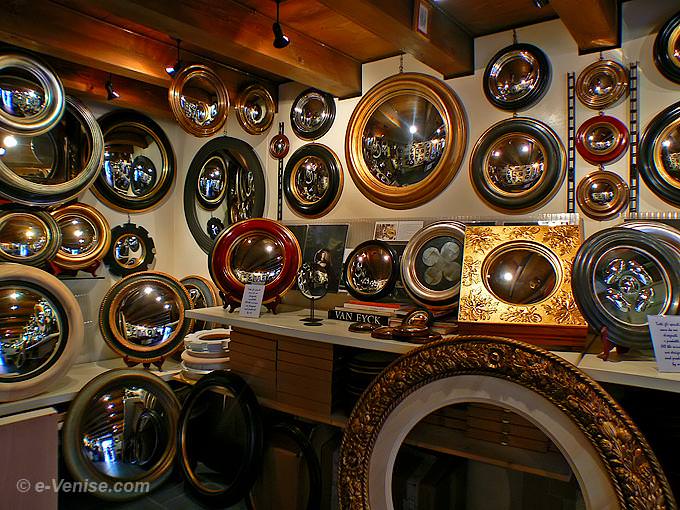
Identify the location of tables. The image size is (680, 510). (294, 330), (95, 367).